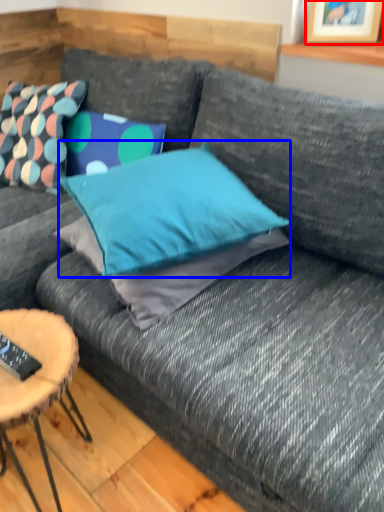
Question: Which point is further to the camera, picture frame (highlighted by a red box) or pillow (highlighted by a blue box)?

Choices:
 (A) picture frame
 (B) pillow

Answer: (A)